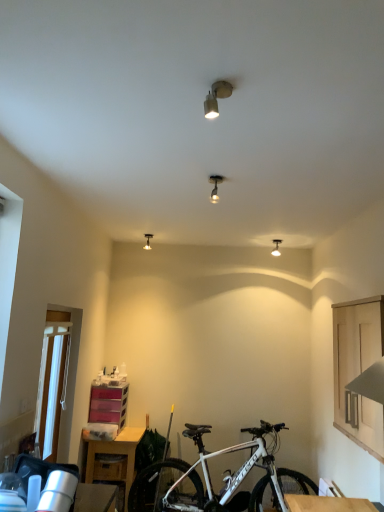
At what (x,y) coordinates should I click in order to perform the action: click on matte silver light fixture at upper center, the 3th light fixture in the top-to-bottom sequence. Please return your answer as a coordinate pair (x, y). Looking at the image, I should click on (147, 241).

Find the location of `transparent glass door at left`. transparent glass door at left is located at coordinates (52, 386).

The height and width of the screenshot is (512, 384). What do you see at coordinates (52, 386) in the screenshot?
I see `transparent glass door at left` at bounding box center [52, 386].

In order to face white matte bicycle at lower center, should I rotate leftwards or rightwards?

It's best to rotate right around 4.647 degrees.

I want to click on matte silver spotlight at upper center, marked as the first light fixture in a top-to-bottom arrangement, so click(x=216, y=98).

How much space does metallic track light at center, placed as the 3th light fixture when sorted from left to right, occupy vertically?

metallic track light at center, placed as the 3th light fixture when sorted from left to right, is 5.74 inches in height.

Image resolution: width=384 pixels, height=512 pixels. I want to click on metallic silver light fixture at upper center, the fourth light fixture viewed from the left, so click(x=276, y=248).

Would you say matte silver light fixture at upper center, which appears as the 4th light fixture when viewed from the front, contains white matte bicycle at lower center?

No.

Is matte silver light fixture at upper center, positioned as the 4th light fixture in right-to-left order, wider than white matte bicycle at lower center?

Incorrect, the width of matte silver light fixture at upper center, positioned as the 4th light fixture in right-to-left order, does not surpass that of white matte bicycle at lower center.

Does matte silver light fixture at upper center, the 1th light fixture from the left, have a lesser height compared to white matte bicycle at lower center?

Yes.

From the image's perspective, is matte silver light fixture at upper center, the 3th light fixture in the top-to-bottom sequence, above or below white matte bicycle at lower center?

matte silver light fixture at upper center, the 3th light fixture in the top-to-bottom sequence, is situated higher than white matte bicycle at lower center in the image.

From a real-world perspective, between white matte bicycle at lower center and wooden table at lower left, which ranks as the 1th table in back-to-front order, who is vertically higher?

white matte bicycle at lower center.

Where is `bicycle on the right of wooden table at lower left, which appears as the first table when viewed from the left`? This screenshot has width=384, height=512. bicycle on the right of wooden table at lower left, which appears as the first table when viewed from the left is located at coordinates (223, 480).

Is white matte bicycle at lower center smaller than wooden table at lower left, which is the second table in top-to-bottom order?

Incorrect, white matte bicycle at lower center is not smaller in size than wooden table at lower left, which is the second table in top-to-bottom order.

Is white matte bicycle at lower center positioned in front of wooden table at lower left, which ranks as the 1th table in back-to-front order?

No, white matte bicycle at lower center is further to the viewer.

Which object is positioned more to the left, wooden table at lower right, which ranks as the 2th table in back-to-front order, or transparent glass door at left?

From the viewer's perspective, transparent glass door at left appears more on the left side.

Considering their positions, is wooden table at lower right, which ranks as the first table in front-to-back order, located in front of or behind transparent glass door at left?

wooden table at lower right, which ranks as the first table in front-to-back order, is in front of transparent glass door at left.

Can you confirm if wooden table at lower right, which is the second table from left to right, is shorter than transparent glass door at left?

Yes.

From the image's perspective, relative to transparent glass door at left, is wooden table at lower right, the first table from the top, above or below?

wooden table at lower right, the first table from the top, is below transparent glass door at left.

Can you confirm if wooden table at lower right, which appears as the second table when ordered from the bottom, is shorter than white matte bicycle at lower center?

Yes.

Considering the sizes of objects wooden table at lower right, which ranks as the first table in front-to-back order, and white matte bicycle at lower center in the image provided, who is smaller, wooden table at lower right, which ranks as the first table in front-to-back order, or white matte bicycle at lower center?

wooden table at lower right, which ranks as the first table in front-to-back order.

What's the angular difference between wooden table at lower right, the first table from the top, and white matte bicycle at lower center's facing directions?

89.8 degrees.

From a real-world perspective, which object stands above the other?

In real-world perspective, wooden table at lower right, the first table when ordered from right to left, is above.

Does wooden table at lower left, which is the second table in top-to-bottom order, have a greater width compared to metallic track light at center, placed as the 3th light fixture when sorted from left to right?

Correct, the width of wooden table at lower left, which is the second table in top-to-bottom order, exceeds that of metallic track light at center, placed as the 3th light fixture when sorted from left to right.

Does wooden table at lower left, which ranks as the 1th table in back-to-front order, have a lesser height compared to metallic track light at center, acting as the 3th light fixture starting from the bottom?

Incorrect, the height of wooden table at lower left, which ranks as the 1th table in back-to-front order, does not fall short of that of metallic track light at center, acting as the 3th light fixture starting from the bottom.

Is wooden table at lower left, which appears as the first table when viewed from the left, further to the viewer compared to metallic track light at center, which is the second light fixture from right to left?

Yes, it is behind metallic track light at center, which is the second light fixture from right to left.

Consider the image. From a real-world perspective, which object stands above the other?

metallic track light at center, the 2th light fixture positioned from the top, from a real-world perspective.

Looking at this image, are matte silver light fixture at upper center, positioned as the 4th light fixture in right-to-left order, and wooden table at lower right, the first table when ordered from right to left, located far from each other?

Yes, matte silver light fixture at upper center, positioned as the 4th light fixture in right-to-left order, and wooden table at lower right, the first table when ordered from right to left, are located far from each other.

Could you tell me if matte silver light fixture at upper center, the 1th light fixture from the left, is facing wooden table at lower right, which appears as the second table when ordered from the bottom?

No, matte silver light fixture at upper center, the 1th light fixture from the left, is not turned towards wooden table at lower right, which appears as the second table when ordered from the bottom.

Is point (150, 246) more distant than point (298, 495)?

Yes.

Relative to wooden table at lower right, the first table when ordered from right to left, is matte silver light fixture at upper center, which appears as the 4th light fixture when viewed from the front, in front or behind?

Clearly, matte silver light fixture at upper center, which appears as the 4th light fixture when viewed from the front, is behind wooden table at lower right, the first table when ordered from right to left.

Is transparent glass door at left positioned with its back to wooden table at lower left, which is the second table in top-to-bottom order?

No, wooden table at lower left, which is the second table in top-to-bottom order, is not at the back of transparent glass door at left.

Which is more distant, [36,406] or [90,451]?

Point [90,451]

Is wooden table at lower left, which appears as the first table when viewed from the left, a part of transparent glass door at left?

That's incorrect, wooden table at lower left, which appears as the first table when viewed from the left, is not inside transparent glass door at left.

From a real-world perspective, starting from the white matte bicycle at lower center, which light fixture is the 3rd one vertically above it? Please provide its 2D coordinates.

[(147, 241)]

The height and width of the screenshot is (512, 384). In order to click on bicycle behind the wooden table at lower left, the second table positioned from the right in this screenshot , I will do `click(223, 480)`.

Estimate the real-world distances between objects in this image. Which object is closer to wooden table at lower left, which is the first table from bottom to top, metallic track light at center, acting as the 3th light fixture starting from the bottom, or matte silver light fixture at upper center, the 3th light fixture in the top-to-bottom sequence?

matte silver light fixture at upper center, the 3th light fixture in the top-to-bottom sequence.

Which object lies nearer to the anchor point matte silver light fixture at upper center, which appears as the second light fixture when ordered from the bottom, white matte bicycle at lower center or metallic track light at center, which is the 3th light fixture in back-to-front order?

metallic track light at center, which is the 3th light fixture in back-to-front order, is positioned closer to the anchor matte silver light fixture at upper center, which appears as the second light fixture when ordered from the bottom.

Based on their spatial positions, is wooden table at lower right, which ranks as the first table in front-to-back order, or metallic silver light fixture at upper center, the fourth light fixture viewed from the left, further from white matte bicycle at lower center?

The object further to white matte bicycle at lower center is metallic silver light fixture at upper center, the fourth light fixture viewed from the left.

Estimate the real-world distances between objects in this image. Which object is further from white matte bicycle at lower center, wooden table at lower right, the first table when ordered from right to left, or metallic track light at center, acting as the 3th light fixture starting from the bottom?

Based on the image, metallic track light at center, acting as the 3th light fixture starting from the bottom, appears to be further to white matte bicycle at lower center.

From the image, which object appears to be nearer to wooden table at lower left, which is the second table in top-to-bottom order, white matte bicycle at lower center or wooden table at lower right, which ranks as the 2th table in back-to-front order?

Among the two, white matte bicycle at lower center is located nearer to wooden table at lower left, which is the second table in top-to-bottom order.

Estimate the real-world distances between objects in this image. Which object is further from wooden table at lower right, which ranks as the 2th table in back-to-front order, metallic track light at center, which is the second light fixture from right to left, or wooden table at lower left, positioned as the second table in front-to-back order?

Among the two, metallic track light at center, which is the second light fixture from right to left, is located further to wooden table at lower right, which ranks as the 2th table in back-to-front order.

From the image, which object appears to be nearer to metallic track light at center, which is the second light fixture from right to left, wooden table at lower right, the first table when ordered from right to left, or metallic silver light fixture at upper center, the fourth light fixture viewed from the top?

metallic silver light fixture at upper center, the fourth light fixture viewed from the top, is positioned closer to the anchor metallic track light at center, which is the second light fixture from right to left.

Estimate the real-world distances between objects in this image. Which object is closer to white matte bicycle at lower center, matte silver light fixture at upper center, which appears as the second light fixture when ordered from the bottom, or transparent glass door at left?

transparent glass door at left.

Locate an element on the screen. The height and width of the screenshot is (512, 384). glass door between metallic silver light fixture at upper center, the fourth light fixture viewed from the top, and white matte bicycle at lower center in the up-down direction is located at coordinates (52, 386).

The height and width of the screenshot is (512, 384). Identify the location of glass door between metallic track light at center, acting as the 3th light fixture starting from the bottom, and wooden table at lower left, which is the first table from bottom to top, in the up-down direction. (52, 386).

You are a GUI agent. You are given a task and a screenshot of the screen. Output one action in this format:
    pyautogui.click(x=<x>, y=<y>)
    Task: Click on the glass door between metallic track light at center, the 2th light fixture positioned from the top, and wooden table at lower right, which is the second table from left to right, in the vertical direction
    The image size is (384, 512).
    Given the screenshot: What is the action you would take?
    pyautogui.click(x=52, y=386)

At what (x,y) coordinates should I click in order to perform the action: click on light fixture between metallic track light at center, acting as the 3th light fixture starting from the bottom, and matte silver light fixture at upper center, which appears as the second light fixture when ordered from the bottom, in the front-back direction. Please return your answer as a coordinate pair (x, y). Image resolution: width=384 pixels, height=512 pixels. Looking at the image, I should click on (276, 248).